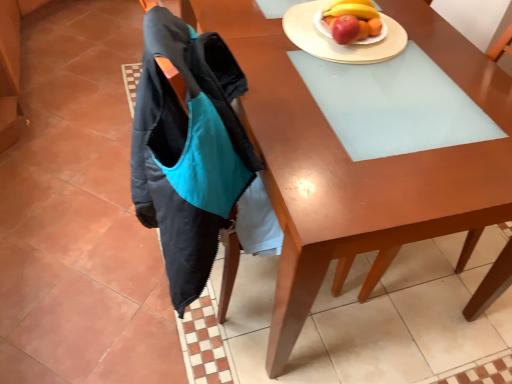
Where is `free spot to the left of white glossy plate at upper right, arranged as the second plate when viewed from the left`? This screenshot has height=384, width=512. free spot to the left of white glossy plate at upper right, arranged as the second plate when viewed from the left is located at coordinates (297, 40).